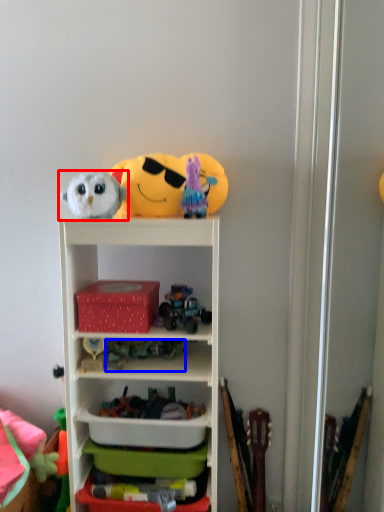
Question: Which of the following is the closest to the observer, toy (highlighted by a red box) or toy (highlighted by a blue box)?

Choices:
 (A) toy
 (B) toy

Answer: (A)